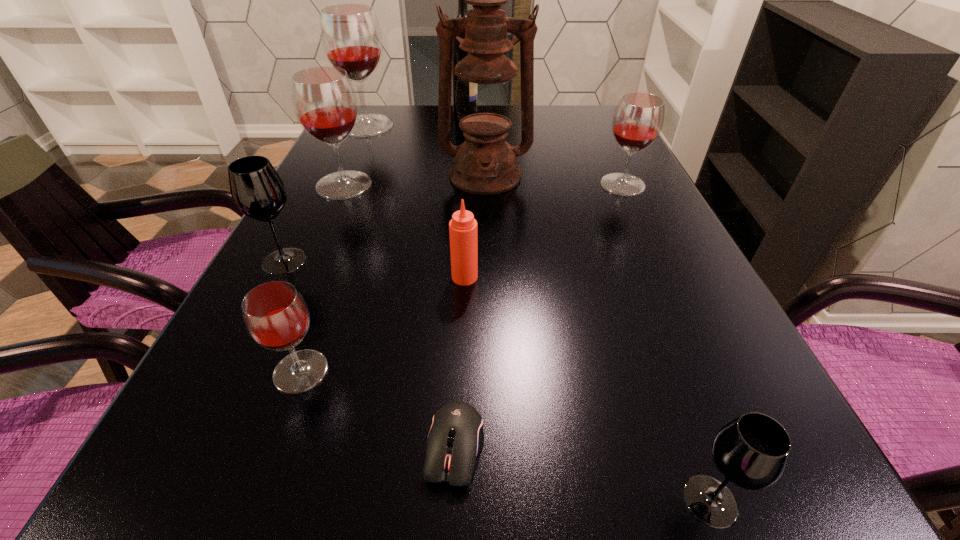
Identify the location of object at the far left corner. (350, 34).

The height and width of the screenshot is (540, 960). In order to click on object at the near right corner in this screenshot , I will do `click(752, 451)`.

In the image, there is a desktop. At what (x,y) coordinates should I click in order to perform the action: click on vacant space at the near edge. Please return your answer as a coordinate pair (x, y). Image resolution: width=960 pixels, height=540 pixels. Looking at the image, I should click on (406, 503).

Where is `free point at the left edge`? Image resolution: width=960 pixels, height=540 pixels. free point at the left edge is located at coordinates [x=273, y=367].

Identify the location of blank space at the right edge of the desktop. The image size is (960, 540). (649, 183).

You are a GUI agent. You are given a task and a screenshot of the screen. Output one action in this format:
    pyautogui.click(x=<x>, y=<y>)
    Task: Click on the free space at the near left corner of the desktop
    This screenshot has width=960, height=540.
    Given the screenshot: What is the action you would take?
    pyautogui.click(x=148, y=502)

In the image, there is a desktop. Where is `vacant space at the far right corner`? The image size is (960, 540). vacant space at the far right corner is located at coordinates (588, 127).

Identify the location of free space at the near right corner. Image resolution: width=960 pixels, height=540 pixels. (834, 506).

The width and height of the screenshot is (960, 540). In order to click on vacant area that lies between the nearer gray wineglass and the Tabasco sauce in this screenshot , I will do `click(588, 389)`.

The image size is (960, 540). Identify the location of vacant region between the smallest red wineglass and the computer mouse. (378, 409).